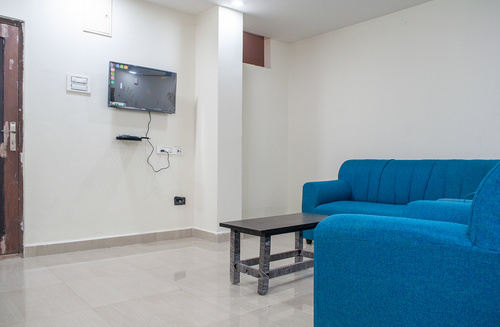
Find the location of a particular element. The height and width of the screenshot is (327, 500). door is located at coordinates (1, 98).